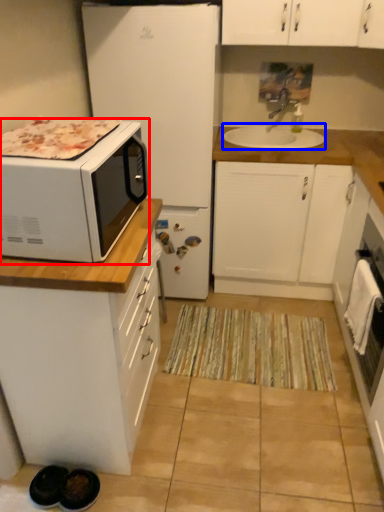
Question: Which of the following is the closest to the observer, microwave oven (highlighted by a red box) or sink (highlighted by a blue box)?

Choices:
 (A) microwave oven
 (B) sink

Answer: (A)